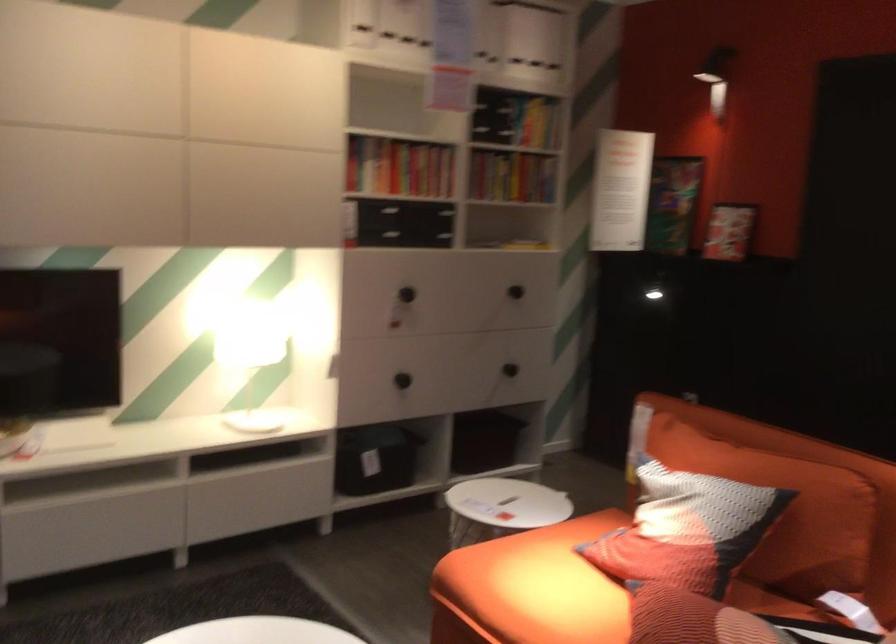
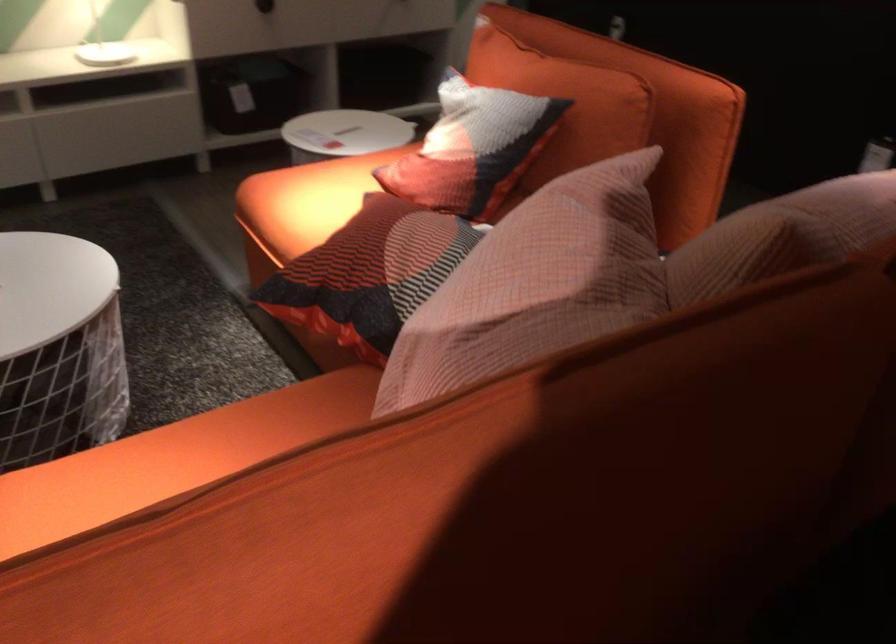
Question: I am providing you with two images of the same scene from different viewpoints. After the viewpoint changes to image2, which objects are now occluded?

Choices:
 (A) black drawer knob
 (B) patterned throw pillow
 (C) sofa sitting surface
 (D) none of these

Answer: (D)